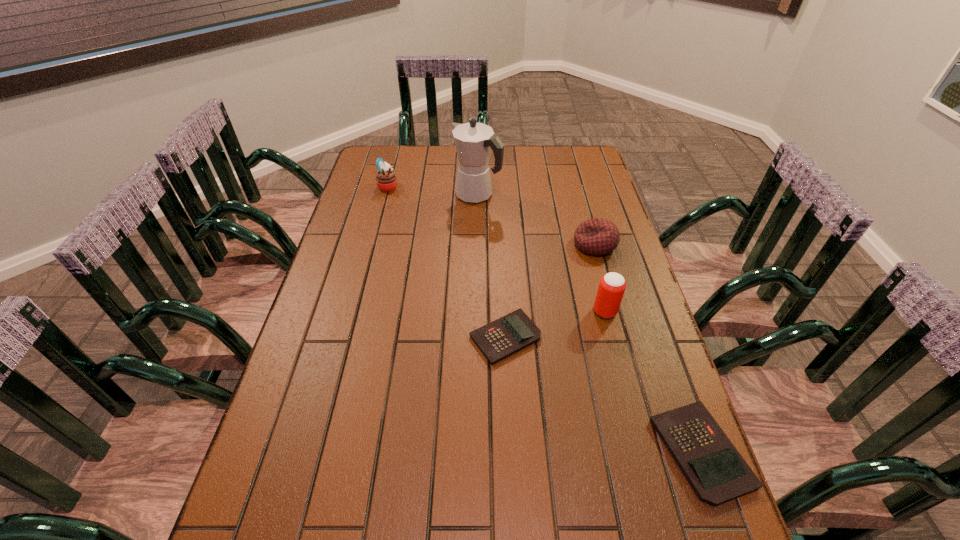
Locate an element on the screen. The image size is (960, 540). free space located 0.120m on the back of the taller calculator is located at coordinates (668, 361).

Image resolution: width=960 pixels, height=540 pixels. I want to click on free point located 0.190m on the right of the tallest object, so click(x=554, y=195).

At what (x,y) coordinates should I click in order to perform the action: click on vacant space located 0.080m on the front-facing side of the leftmost object. Please return your answer as a coordinate pair (x, y). Looking at the image, I should click on (420, 186).

Locate an element on the screen. This screenshot has width=960, height=540. vacant position located on the back of the beer can is located at coordinates (594, 273).

Image resolution: width=960 pixels, height=540 pixels. What are the coordinates of `vacant position located 0.320m on the front of the beanbag` in the screenshot? It's located at (623, 344).

At what (x,y) coordinates should I click in order to perform the action: click on object that is positioned at the near edge. Please return your answer as a coordinate pair (x, y). This screenshot has width=960, height=540. Looking at the image, I should click on (716, 471).

The width and height of the screenshot is (960, 540). I want to click on object at the left edge, so click(x=386, y=180).

You are a GUI agent. You are given a task and a screenshot of the screen. Output one action in this format:
    pyautogui.click(x=<x>, y=<y>)
    Task: Click on the calculator that is positioned at the right edge
    This screenshot has width=960, height=540.
    Given the screenshot: What is the action you would take?
    pyautogui.click(x=716, y=471)

The height and width of the screenshot is (540, 960). What are the coordinates of `beer can situated at the right edge` in the screenshot? It's located at (612, 285).

The height and width of the screenshot is (540, 960). In order to click on beanbag that is at the right edge in this screenshot , I will do click(x=597, y=236).